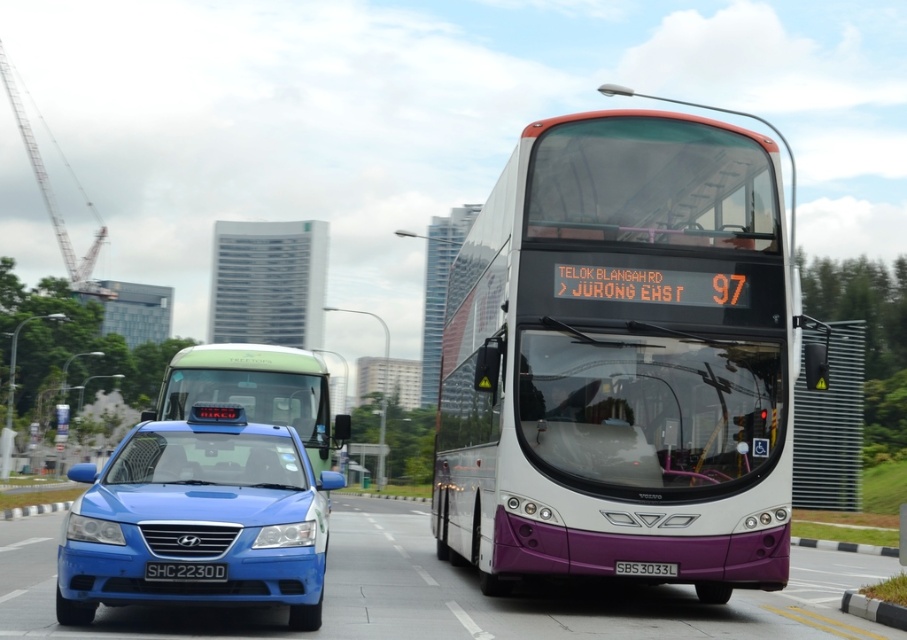
Question: Considering the real-world distances, which object is closest to the black plastic license plate at center?

Choices:
 (A) metallic gray crane at left
 (B) white plastic license plate at center
 (C) blue glossy car at lower left

Answer: (B)

Question: Does blue glossy car at lower left appear under green matte taxi at left?

Choices:
 (A) no
 (B) yes

Answer: (B)

Question: Which of these objects is positioned farthest from the green matte taxi at left?

Choices:
 (A) blue glossy car at lower left
 (B) black plastic license plate at center

Answer: (A)

Question: Which object is positioned closest to the white plastic license plate at center?

Choices:
 (A) blue glossy car at lower left
 (B) white/purple metallic bus at center
 (C) metallic gray crane at left
 (D) black plastic license plate at center

Answer: (B)

Question: Is blue glossy car at lower left behind metallic gray crane at left?

Choices:
 (A) yes
 (B) no

Answer: (B)

Question: Is white/purple metallic bus at center smaller than green matte taxi at left?

Choices:
 (A) yes
 (B) no

Answer: (B)